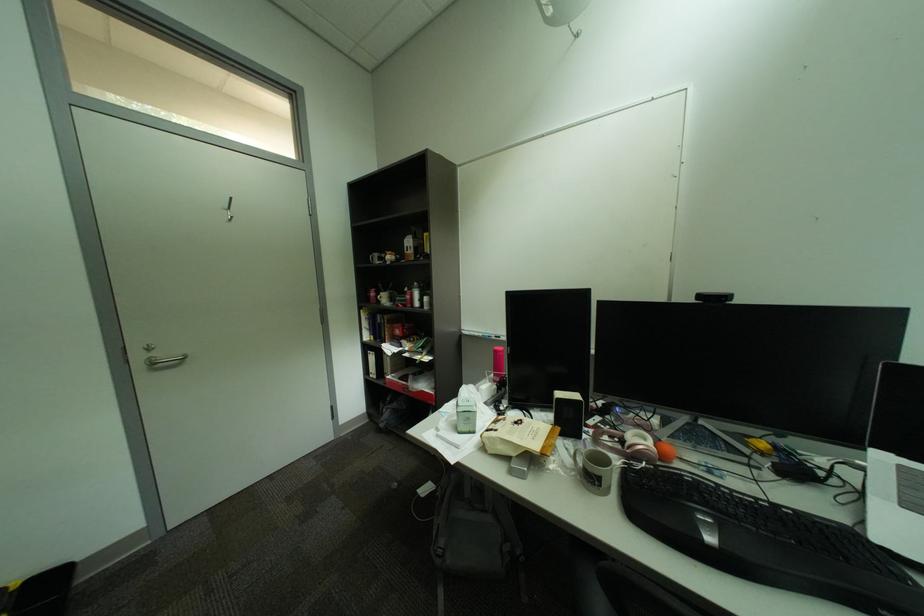
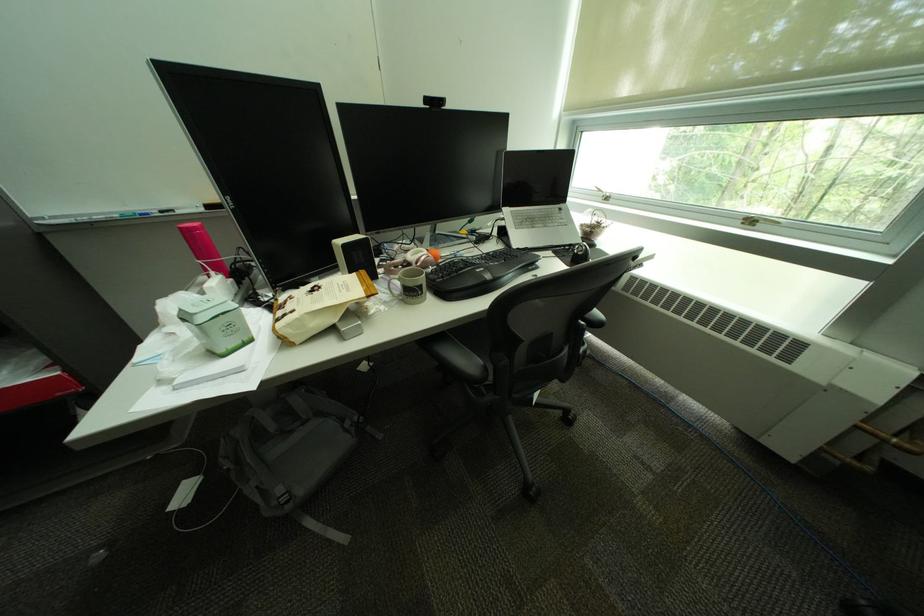
The point at (469, 431) is marked in the first image. Where is the corresponding point in the second image?

(232, 353)